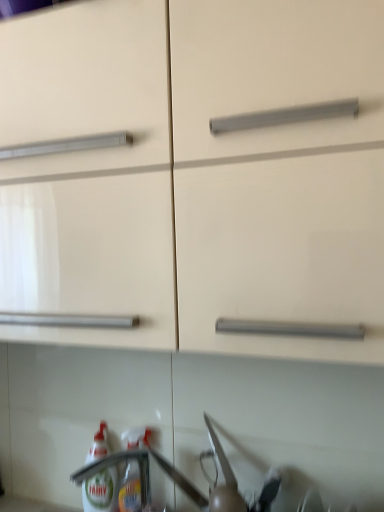
Question: Does matte white cabinet at center come behind translucent plastic bottle at lower left, arranged as the second bottle when viewed from the left?

Choices:
 (A) yes
 (B) no

Answer: (B)

Question: Is matte white cabinet at center facing away from translucent plastic bottle at lower left, arranged as the second bottle when viewed from the left?

Choices:
 (A) yes
 (B) no

Answer: (B)

Question: Is the surface of matte white cabinet at center in direct contact with translucent plastic bottle at lower left, positioned as the first bottle in right-to-left order?

Choices:
 (A) yes
 (B) no

Answer: (B)

Question: Does matte white cabinet at center turn towards translucent plastic bottle at lower left, positioned as the first bottle in right-to-left order?

Choices:
 (A) no
 (B) yes

Answer: (A)

Question: Can you confirm if matte white cabinet at center is positioned to the left of translucent plastic bottle at lower left, positioned as the first bottle in right-to-left order?

Choices:
 (A) yes
 (B) no

Answer: (B)

Question: Is white glossy bottle at lower left, the first bottle positioned from the left, taller or shorter than matte white cabinet at center?

Choices:
 (A) short
 (B) tall

Answer: (A)

Question: In the image, is white glossy bottle at lower left, acting as the second bottle starting from the right, positioned in front of or behind matte white cabinet at center?

Choices:
 (A) behind
 (B) front

Answer: (A)

Question: Is white glossy bottle at lower left, acting as the second bottle starting from the right, bigger or smaller than matte white cabinet at center?

Choices:
 (A) big
 (B) small

Answer: (B)

Question: From a real-world perspective, is white glossy bottle at lower left, acting as the second bottle starting from the right, above or below matte white cabinet at center?

Choices:
 (A) below
 (B) above

Answer: (A)

Question: Considering the positions of matte white cabinet at center and white glossy bottle at lower left, acting as the second bottle starting from the right, in the image, is matte white cabinet at center bigger or smaller than white glossy bottle at lower left, acting as the second bottle starting from the right,?

Choices:
 (A) small
 (B) big

Answer: (B)

Question: In terms of height, does matte white cabinet at center look taller or shorter compared to white glossy bottle at lower left, the first bottle positioned from the left?

Choices:
 (A) short
 (B) tall

Answer: (B)

Question: Relative to white glossy bottle at lower left, the first bottle positioned from the left, is matte white cabinet at center in front or behind?

Choices:
 (A) behind
 (B) front

Answer: (B)

Question: Looking at their shapes, would you say matte white cabinet at center is wider or thinner than white glossy bottle at lower left, acting as the second bottle starting from the right?

Choices:
 (A) thin
 (B) wide

Answer: (B)

Question: Does point (251, 2) appear closer or farther from the camera than point (139, 498)?

Choices:
 (A) closer
 (B) farther

Answer: (A)

Question: Is matte white cabinet at center spatially inside translucent plastic bottle at lower left, arranged as the second bottle when viewed from the left, or outside of it?

Choices:
 (A) inside
 (B) outside

Answer: (B)